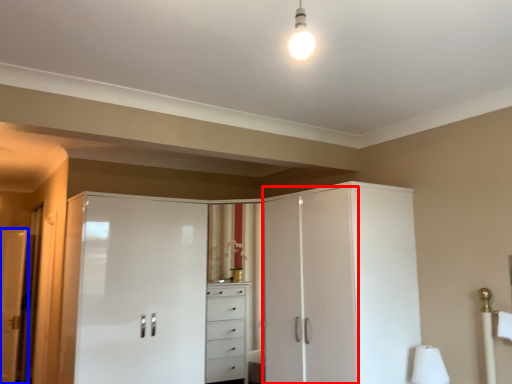
Question: Which point is closer to the camera, screen door (highlighted by a red box) or door (highlighted by a blue box)?

Choices:
 (A) screen door
 (B) door

Answer: (A)